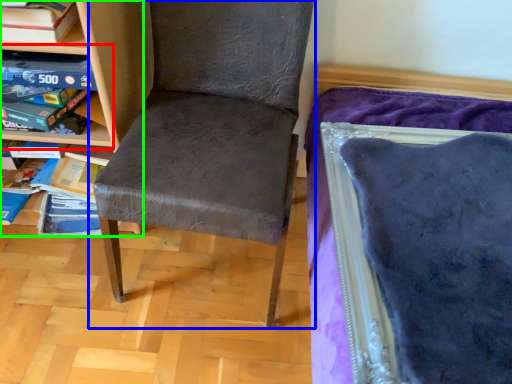
Question: Estimate the real-world distances between objects in this image. Which object is closer to shelf (highlighted by a red box), chair (highlighted by a blue box) or shelf (highlighted by a green box)?

Choices:
 (A) chair
 (B) shelf

Answer: (B)